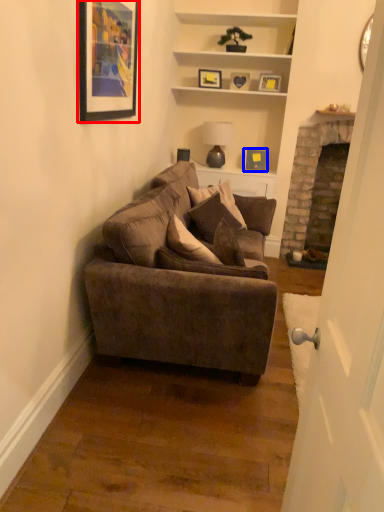
Question: Which point is closer to the camera, picture frame (highlighted by a red box) or picture frame (highlighted by a blue box)?

Choices:
 (A) picture frame
 (B) picture frame

Answer: (A)